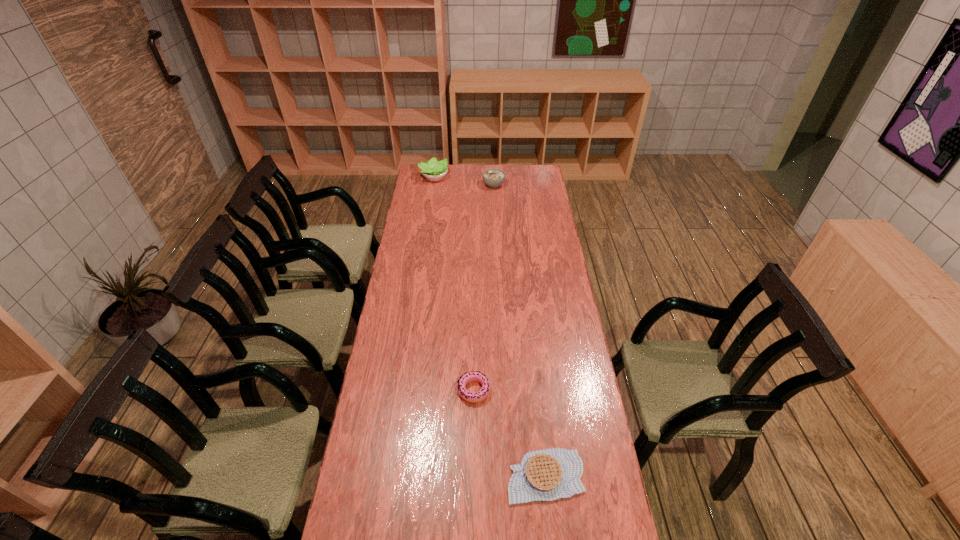
You are a GUI agent. You are given a task and a screenshot of the screen. Output one action in this format:
    pyautogui.click(x=<x>, y=<y>)
    Task: Click on the soup bowl present at the far edge
    The width and height of the screenshot is (960, 540).
    Given the screenshot: What is the action you would take?
    pyautogui.click(x=493, y=177)

Image resolution: width=960 pixels, height=540 pixels. What are the coordinates of `object present at the left edge` in the screenshot? It's located at (434, 170).

Locate an element on the screen. object located in the right edge section of the desktop is located at coordinates (543, 475).

I want to click on object present at the far left corner, so click(x=434, y=170).

This screenshot has height=540, width=960. I want to click on blank space at the left edge of the desktop, so click(x=421, y=234).

In the image, there is a desktop. Where is `free space at the right edge`? The width and height of the screenshot is (960, 540). free space at the right edge is located at coordinates (552, 233).

This screenshot has width=960, height=540. I want to click on vacant area at the far right corner of the desktop, so click(520, 167).

At what (x,y) coordinates should I click in order to perform the action: click on free spot between the pie and the doughnut. Please return your answer as a coordinate pair (x, y). The height and width of the screenshot is (540, 960). Looking at the image, I should click on (510, 433).

At what (x,y) coordinates should I click in order to perform the action: click on vacant space that's between the soup bowl and the second nearest object. Please return your answer as a coordinate pair (x, y). Looking at the image, I should click on (484, 288).

Find the location of a particular element. This screenshot has width=960, height=540. blank region between the pie and the soup bowl is located at coordinates 519,330.